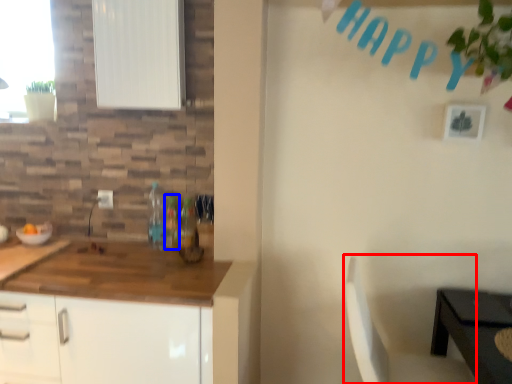
Question: Which object appears farthest to the camera in this image, chair (highlighted by a red box) or bottle (highlighted by a blue box)?

Choices:
 (A) chair
 (B) bottle

Answer: (B)